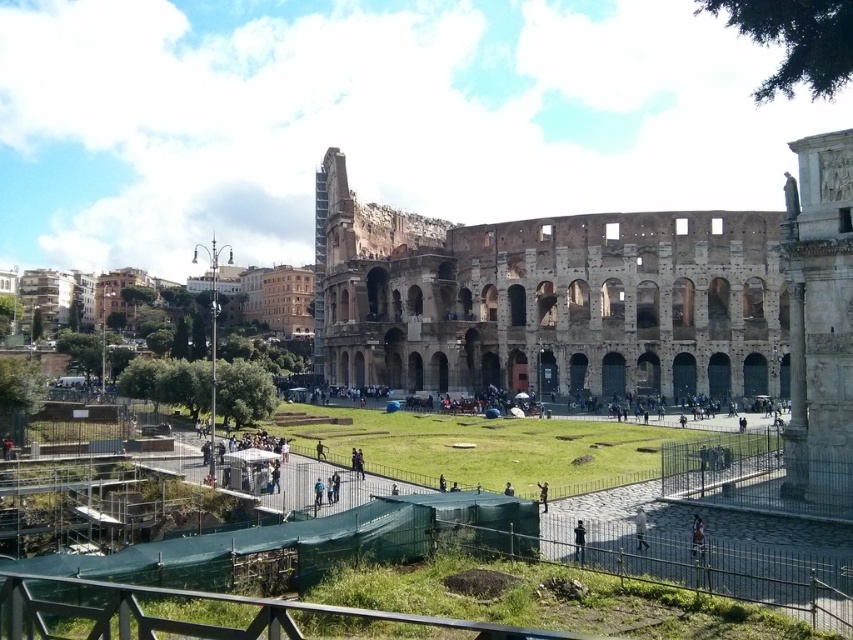
You are a tourist standing at the point with coordinates [549,300] in the Colosseum area. What is the nearest object to you?

The nearest object to you is the brown stone amphitheater at center, as the point coordinates [549,300] indicates its location.